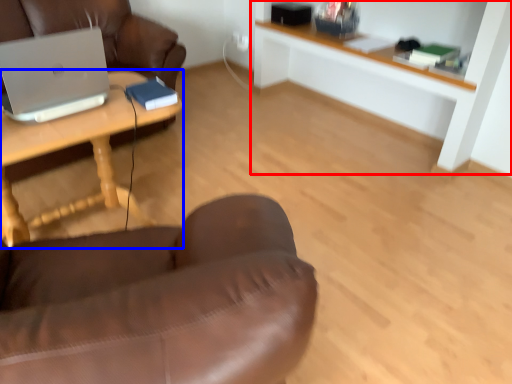
Question: Which object appears closest to the camera in this image, shelf (highlighted by a red box) or desk (highlighted by a blue box)?

Choices:
 (A) shelf
 (B) desk

Answer: (B)